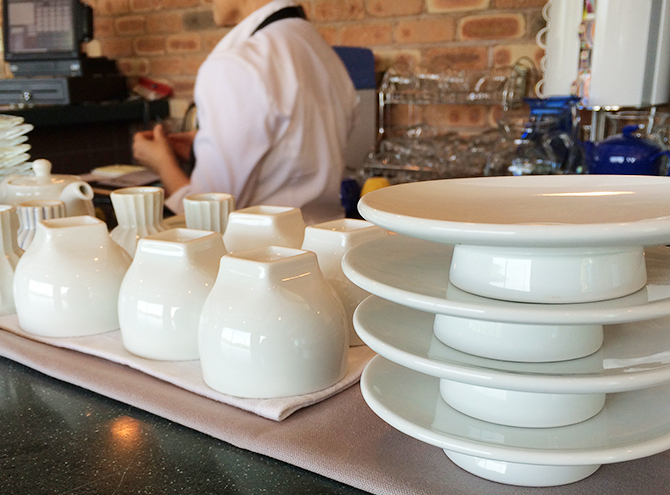
The height and width of the screenshot is (495, 670). I want to click on cups, so click(x=254, y=307), click(x=177, y=292), click(x=70, y=269), click(x=330, y=235), click(x=262, y=226).